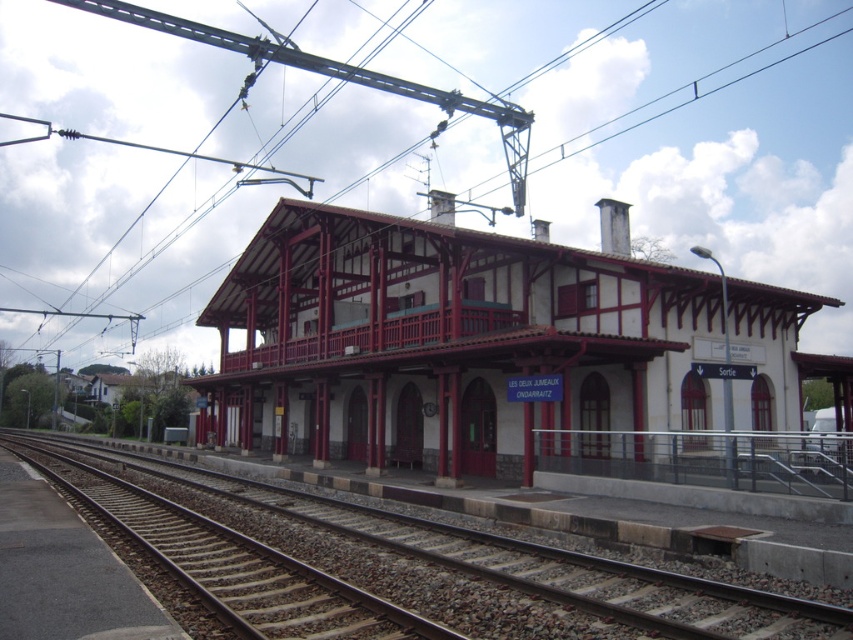
You are standing at the point marked as point (479, 346) in the image. What structure are you directly facing?

The point (479, 346) corresponds to the white wood railway station at center, so you are directly facing the white wood railway station at center.

You are standing on the platform of the white wood railway station at center. You want to walk towards the smooth gravel track at center. Which direction should you walk to reach the track?

You should walk to your left to reach the smooth gravel track at center because the white wood railway station at center is to the right of the track.

You are standing at the platform of the white wood railway station at center. You want to walk to the black metal railing at lower right. Which direction should you move to reach it?

The black metal railing at lower right is located below the white wood railway station at center, so you should move downward to reach it.